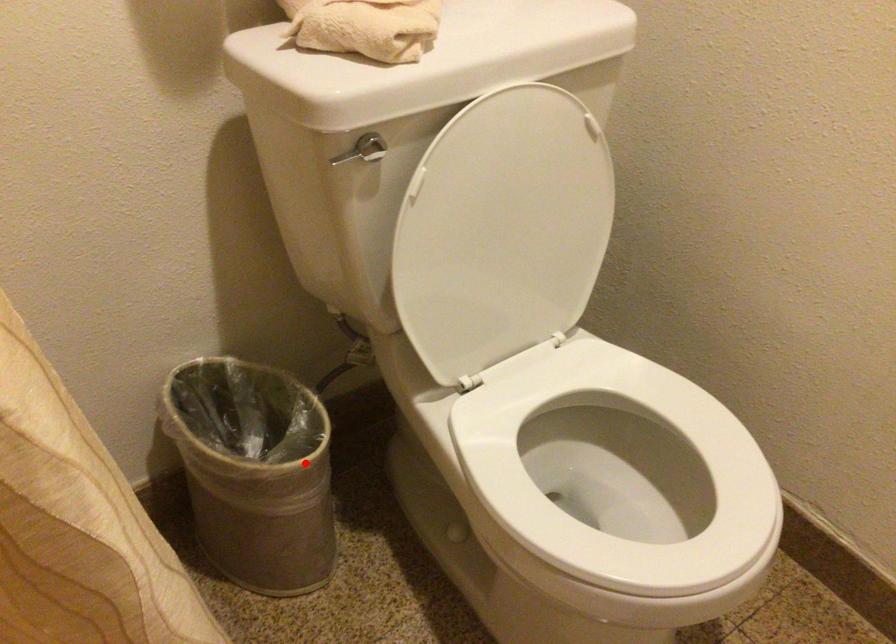
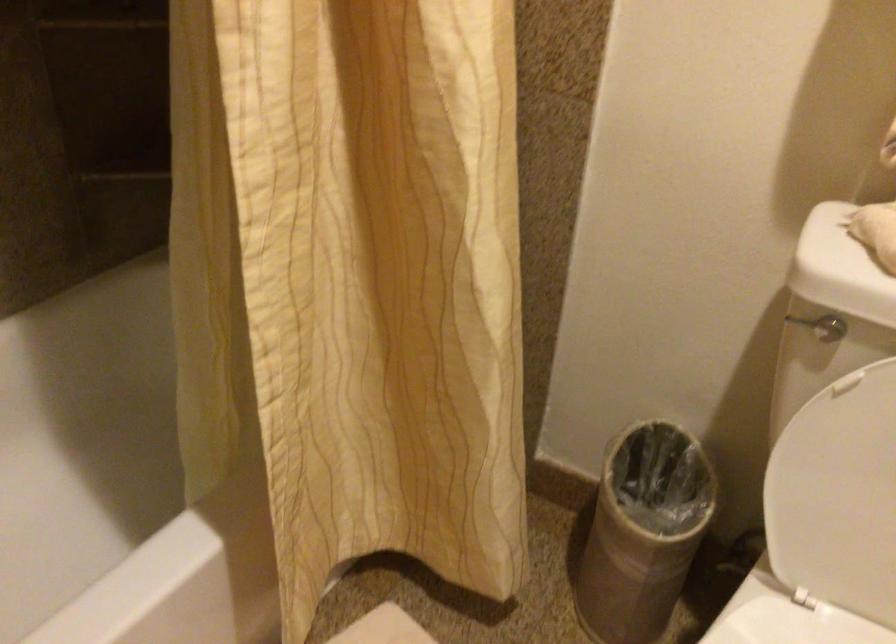
Question: I am providing you with two images of the same scene from different viewpoints. A red point is shown in image1. For the corresponding object point in image2, is it positioned nearer or farther from the camera?

Choices:
 (A) Nearer
 (B) Farther

Answer: (B)